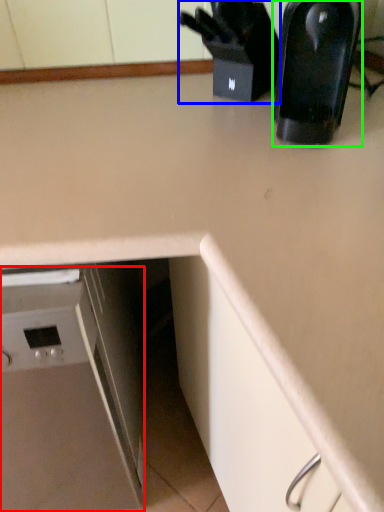
Question: Which object is positioned farthest from home appliance (highlighted by a red box)? Select from appliance (highlighted by a blue box) and kitchen appliance (highlighted by a green box).

Choices:
 (A) appliance
 (B) kitchen appliance

Answer: (A)